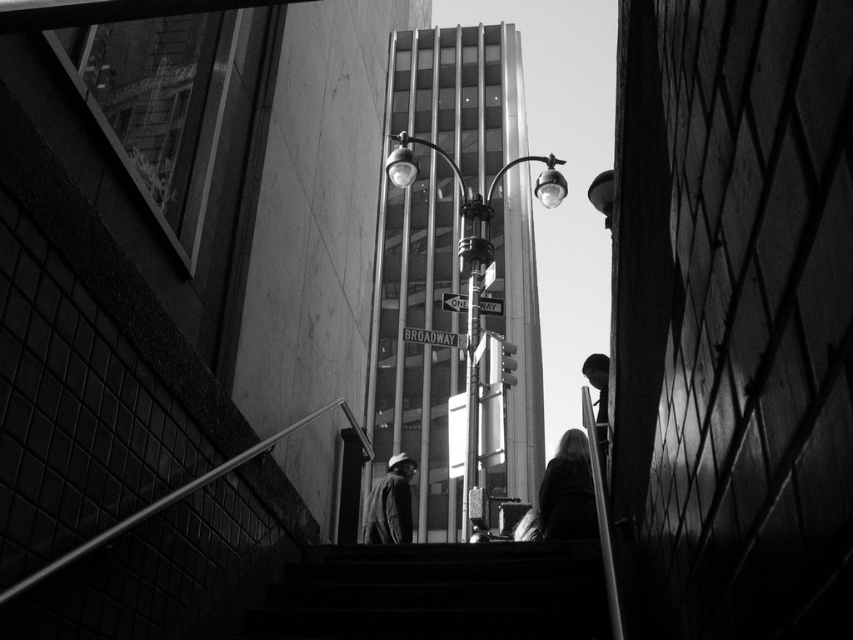
Question: Which object is farther from the camera taking this photo?

Choices:
 (A) silky black hair at lower right
 (B) smooth concrete stairs at center
 (C) smooth black jacket at right
 (D) matte gray jacket at center

Answer: (D)

Question: Is silky black hair at lower right positioned at the back of smooth black jacket at right?

Choices:
 (A) no
 (B) yes

Answer: (B)

Question: Can you confirm if silky black hair at lower right is smaller than matte gray jacket at center?

Choices:
 (A) no
 (B) yes

Answer: (B)

Question: Which point is closer to the camera?

Choices:
 (A) (480, 612)
 (B) (379, 506)
 (C) (596, 401)
 (D) (566, 438)

Answer: (A)

Question: Estimate the real-world distances between objects in this image. Which object is closer to the smooth concrete stairs at center?

Choices:
 (A) silky black hair at lower right
 (B) smooth black jacket at right

Answer: (B)

Question: Can you confirm if silky black hair at lower right is positioned above matte gray jacket at center?

Choices:
 (A) no
 (B) yes

Answer: (B)